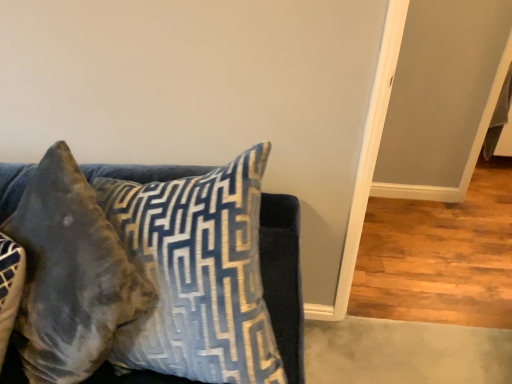
Question: Can you confirm if velvet blue pillow at upper left, which ranks as the second pillow in left-to-right order, is wider than velvet brown pillow at left, acting as the 2th pillow starting from the right?

Choices:
 (A) no
 (B) yes

Answer: (B)

Question: Is velvet blue pillow at upper left, which ranks as the second pillow in left-to-right order, next to velvet brown pillow at left, the 1th pillow in the left-to-right sequence, and touching it?

Choices:
 (A) yes
 (B) no

Answer: (B)

Question: From the image's perspective, does velvet blue pillow at upper left, the first pillow from the right, appear higher than velvet brown pillow at left, the 1th pillow in the left-to-right sequence?

Choices:
 (A) yes
 (B) no

Answer: (A)

Question: Is velvet blue pillow at upper left, the first pillow from the right, taller than velvet brown pillow at left, the 1th pillow in the left-to-right sequence?

Choices:
 (A) no
 (B) yes

Answer: (B)

Question: Does velvet blue pillow at upper left, which ranks as the second pillow in left-to-right order, have a lesser height compared to velvet brown pillow at left, the 1th pillow in the left-to-right sequence?

Choices:
 (A) no
 (B) yes

Answer: (A)

Question: From a real-world perspective, is velvet blue pillow at upper left, the first pillow from the right, on velvet brown pillow at left, acting as the 2th pillow starting from the right?

Choices:
 (A) yes
 (B) no

Answer: (A)

Question: Could you tell me if velvet brown pillow at left, acting as the 2th pillow starting from the right, is turned towards velvet blue pillow at upper left, which ranks as the second pillow in left-to-right order?

Choices:
 (A) yes
 (B) no

Answer: (B)

Question: Can you confirm if velvet brown pillow at left, acting as the 2th pillow starting from the right, is wider than velvet blue pillow at upper left, which ranks as the second pillow in left-to-right order?

Choices:
 (A) no
 (B) yes

Answer: (A)

Question: Can you confirm if velvet brown pillow at left, acting as the 2th pillow starting from the right, is positioned to the right of velvet blue pillow at upper left, the first pillow from the right?

Choices:
 (A) yes
 (B) no

Answer: (B)

Question: Is velvet brown pillow at left, acting as the 2th pillow starting from the right, not within velvet blue pillow at upper left, which ranks as the second pillow in left-to-right order?

Choices:
 (A) no
 (B) yes

Answer: (B)

Question: Is velvet brown pillow at left, acting as the 2th pillow starting from the right, facing away from velvet blue pillow at upper left, the first pillow from the right?

Choices:
 (A) yes
 (B) no

Answer: (B)

Question: Can you confirm if velvet brown pillow at left, acting as the 2th pillow starting from the right, is taller than velvet blue pillow at upper left, the first pillow from the right?

Choices:
 (A) yes
 (B) no

Answer: (B)

Question: In terms of height, does velvet blue pillow at upper left, which ranks as the second pillow in left-to-right order, look taller or shorter compared to velvet brown pillow at left, the 1th pillow in the left-to-right sequence?

Choices:
 (A) tall
 (B) short

Answer: (A)